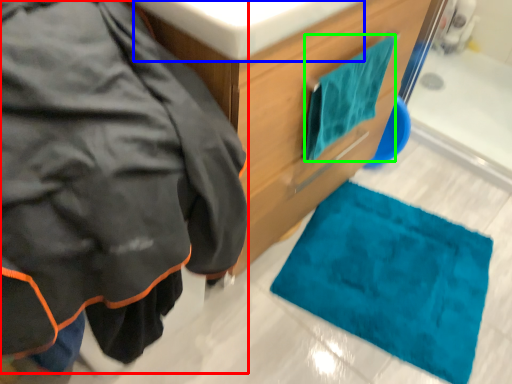
Question: Which is farther away from jacket (highlighted by a red box)? sink (highlighted by a blue box) or towel/napkin (highlighted by a green box)?

Choices:
 (A) sink
 (B) towel/napkin

Answer: (B)